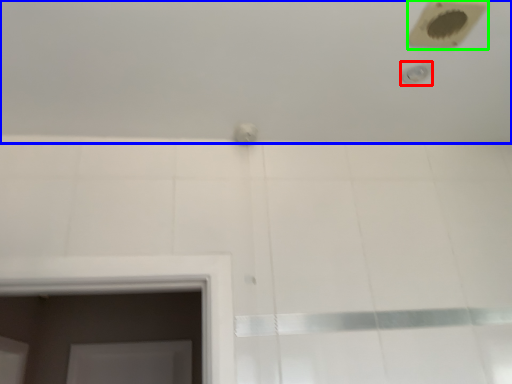
Question: Based on their relative distances, which object is farther from shower (highlighted by a red box)? Choose from bath (highlighted by a blue box) and hole (highlighted by a green box).

Choices:
 (A) bath
 (B) hole

Answer: (A)